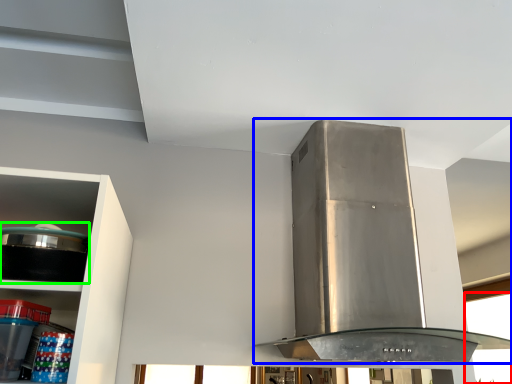
Question: Based on their relative distances, which object is farther from window (highlighted by a red box)? Choose from home appliance (highlighted by a blue box) and appliance (highlighted by a green box).

Choices:
 (A) home appliance
 (B) appliance

Answer: (B)